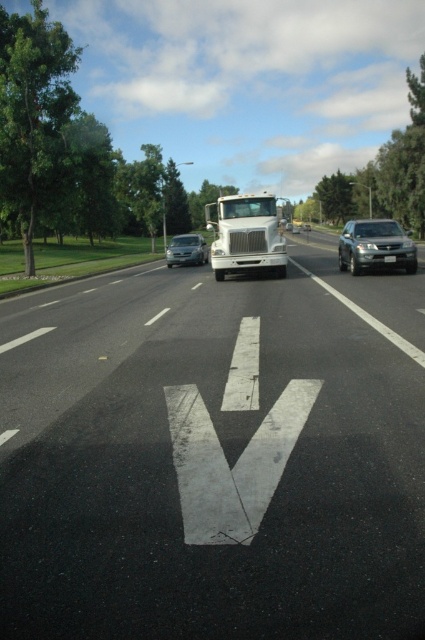
Which is below, white matte truck at center or satin silver suv at right?

Positioned lower is satin silver suv at right.

Is white matte truck at center taller than satin silver suv at right?

Correct, white matte truck at center is much taller as satin silver suv at right.

Describe the element at coordinates (246, 236) in the screenshot. Image resolution: width=425 pixels, height=640 pixels. I see `white matte truck at center` at that location.

Locate an element on the screen. This screenshot has width=425, height=640. white matte truck at center is located at coordinates (246, 236).

Which is in front, point (368, 243) or point (189, 248)?

Point (368, 243) is more forward.

Does satin silver suv at right appear on the right side of satin silver sedan at center?

Yes, satin silver suv at right is to the right of satin silver sedan at center.

Who is more forward, (382, 218) or (195, 241)?

Point (195, 241) is more forward.

In order to click on satin silver suv at right in this screenshot , I will do `click(376, 246)`.

Does white asphalt road at center have a lesser height compared to satin silver sedan at center?

In fact, white asphalt road at center may be taller than satin silver sedan at center.

How far apart are white asphalt road at center and satin silver sedan at center?

white asphalt road at center and satin silver sedan at center are 19.33 meters apart.

I want to click on white asphalt road at center, so click(214, 456).